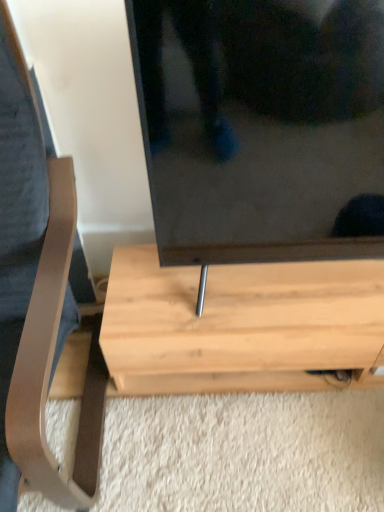
Locate an element on the screen. The height and width of the screenshot is (512, 384). empty space that is ontop of light wood table at center is located at coordinates (253, 291).